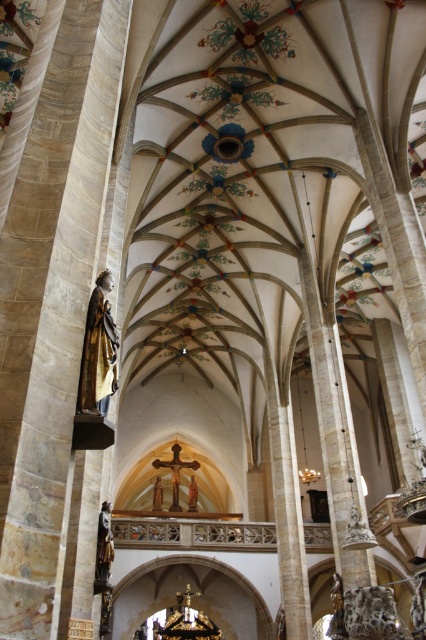
Is wooden cross at center below polished bronze statue at lower left?

Yes, wooden cross at center is below polished bronze statue at lower left.

Based on the photo, who is shorter, wooden cross at center or polished bronze statue at lower left?

polished bronze statue at lower left

Which is behind, point (178, 460) or point (104, 532)?

Point (178, 460)

Where is `wooden cross at center`? wooden cross at center is located at coordinates (175, 472).

Does polished bronze statue at left come in front of polished bronze statue at lower left?

Yes, polished bronze statue at left is closer to the viewer.

Does point (115, 388) lie behind point (97, 572)?

No, it is not.

Locate an element on the screen. Image resolution: width=426 pixels, height=640 pixels. polished bronze statue at left is located at coordinates click(98, 352).

Which is more to the right, polished bronze statue at left or wooden cross at center?

From the viewer's perspective, polished bronze statue at left appears more on the right side.

Does polished bronze statue at left have a larger size compared to wooden cross at center?

Actually, polished bronze statue at left might be smaller than wooden cross at center.

Does point (101, 356) lie in front of point (173, 508)?

Yes.

Identify the location of polished bronze statue at left. (98, 352).